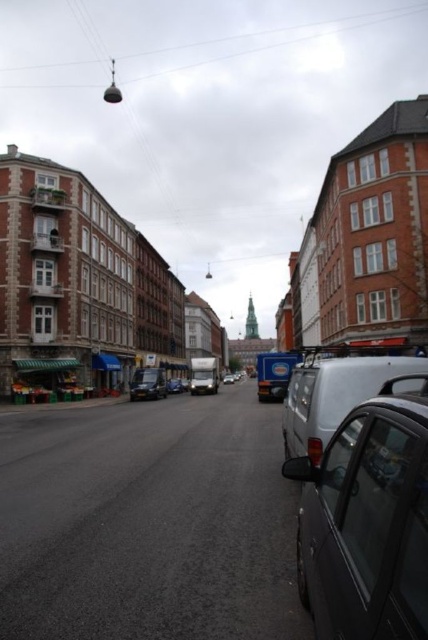
Is metallic gray car at right taller than metallic silver van at center?

No.

Is metallic gray car at right to the left of metallic silver van at center from the viewer's perspective?

No, metallic gray car at right is not to the left of metallic silver van at center.

The width and height of the screenshot is (428, 640). What are the coordinates of `metallic gray car at right` in the screenshot? It's located at (368, 520).

Can you confirm if metallic gray car at right is taller than silver metallic van at center?

In fact, metallic gray car at right may be shorter than silver metallic van at center.

Which of these two, metallic gray car at right or silver metallic van at center, stands shorter?

metallic gray car at right

This screenshot has width=428, height=640. In order to click on metallic gray car at right in this screenshot , I will do `click(368, 520)`.

Does white matte van at center-right appear over metallic silver van at center?

Correct, white matte van at center-right is located above metallic silver van at center.

Is point (354, 378) positioned before point (177, 392)?

Yes, it is in front of point (177, 392).

Locate an element on the screen. Image resolution: width=428 pixels, height=640 pixels. white matte van at center-right is located at coordinates (336, 388).